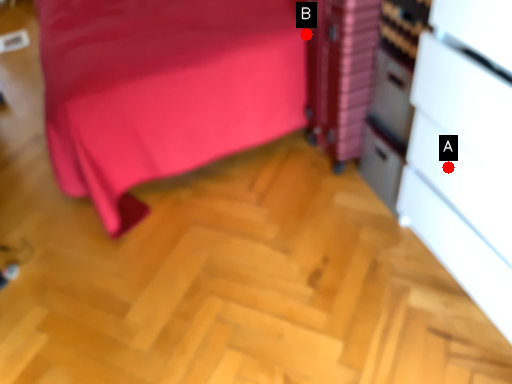
Question: Two points are circled on the image, labeled by A and B beside each circle. Among these points, which one is farthest from the camera?

Choices:
 (A) A is further
 (B) B is further

Answer: (B)